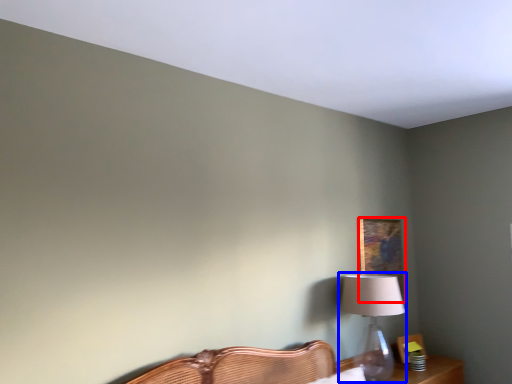
Question: Which object is further to the camera taking this photo, picture frame (highlighted by a red box) or table lamp (highlighted by a blue box)?

Choices:
 (A) picture frame
 (B) table lamp

Answer: (A)